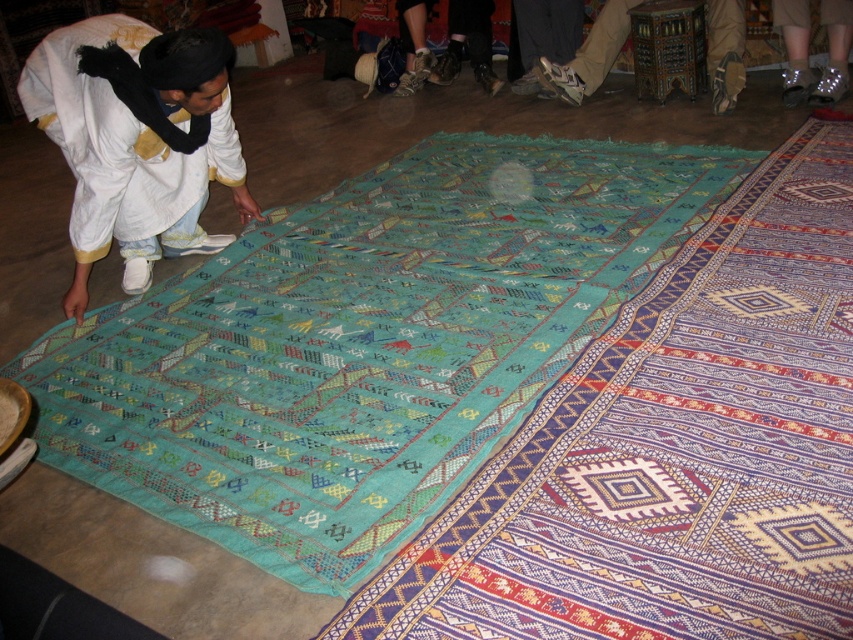
Can you confirm if multicolored woven rug at center is smaller than leather boots at center?

No.

Is multicolored woven rug at center thinner than leather boots at center?

Incorrect, multicolored woven rug at center's width is not less than leather boots at center's.

Locate an element on the screen. The width and height of the screenshot is (853, 640). multicolored woven rug at center is located at coordinates (672, 449).

Which of these two, white cotton clothing at center or leather boots at center, stands taller?

white cotton clothing at center

Is white cotton clothing at center closer to the viewer compared to leather boots at center?

Yes, it is in front of leather boots at center.

Does point (177, 188) come closer to viewer compared to point (416, 68)?

Yes, point (177, 188) is closer to viewer.

At what (x,y) coordinates should I click in order to perform the action: click on white cotton clothing at center. Please return your answer as a coordinate pair (x, y). The image size is (853, 640). Looking at the image, I should click on (137, 140).

Which is in front, point (471, 4) or point (802, 45)?

Point (802, 45) is more forward.

Between point (447, 17) and point (799, 84), which one is positioned behind?

The point (447, 17) is behind.

Between point (482, 12) and point (838, 80), which one is positioned behind?

The point (482, 12) is more distant.

Locate an element on the screen. The image size is (853, 640). leather boots at center is located at coordinates (445, 44).